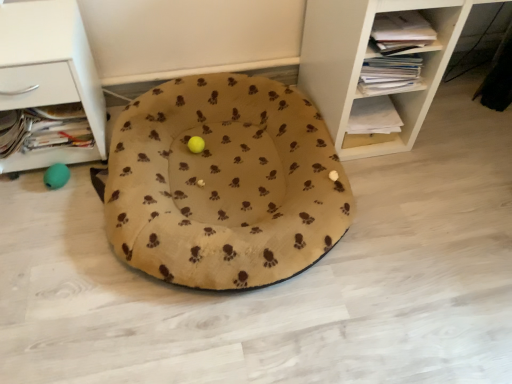
Question: Does white wood shelf at upper right, which ranks as the second shelf in left-to-right order, have a lesser width compared to beige fleece dog bed at center?

Choices:
 (A) no
 (B) yes

Answer: (B)

Question: From the image's perspective, is white wood shelf at upper right, which is counted as the 1th shelf, starting from the right, above beige fleece dog bed at center?

Choices:
 (A) no
 (B) yes

Answer: (B)

Question: Is white wood shelf at upper right, which is counted as the 1th shelf, starting from the right, to the left of beige fleece dog bed at center from the viewer's perspective?

Choices:
 (A) no
 (B) yes

Answer: (A)

Question: Is white wood shelf at upper right, which ranks as the second shelf in left-to-right order, bigger than beige fleece dog bed at center?

Choices:
 (A) no
 (B) yes

Answer: (B)

Question: Considering the relative positions of white wood shelf at upper right, which ranks as the second shelf in left-to-right order, and beige fleece dog bed at center in the image provided, is white wood shelf at upper right, which ranks as the second shelf in left-to-right order, to the right of beige fleece dog bed at center from the viewer's perspective?

Choices:
 (A) no
 (B) yes

Answer: (B)

Question: Is white wood shelf at upper right, which is counted as the 1th shelf, starting from the right, wider or thinner than white matte drawer at left, positioned as the 2th shelf in right-to-left order?

Choices:
 (A) wide
 (B) thin

Answer: (A)

Question: Do you think white wood shelf at upper right, which is counted as the 1th shelf, starting from the right, is within white matte drawer at left, positioned as the 2th shelf in right-to-left order, or outside of it?

Choices:
 (A) outside
 (B) inside

Answer: (A)

Question: Is white wood shelf at upper right, which ranks as the second shelf in left-to-right order, bigger or smaller than white matte drawer at left, positioned as the 2th shelf in right-to-left order?

Choices:
 (A) big
 (B) small

Answer: (A)

Question: In the image, is white wood shelf at upper right, which ranks as the second shelf in left-to-right order, positioned in front of or behind white matte drawer at left, positioned as the 2th shelf in right-to-left order?

Choices:
 (A) front
 (B) behind

Answer: (A)

Question: Does point (14, 6) appear closer or farther from the camera than point (135, 223)?

Choices:
 (A) farther
 (B) closer

Answer: (A)

Question: Considering the positions of white matte drawer at left, which is counted as the 1th shelf, starting from the left, and beige fleece dog bed at center in the image, is white matte drawer at left, which is counted as the 1th shelf, starting from the left, taller or shorter than beige fleece dog bed at center?

Choices:
 (A) tall
 (B) short

Answer: (A)

Question: In the image, is white matte drawer at left, which is counted as the 1th shelf, starting from the left, positioned in front of or behind beige fleece dog bed at center?

Choices:
 (A) front
 (B) behind

Answer: (B)

Question: From the image's perspective, is white matte drawer at left, positioned as the 2th shelf in right-to-left order, positioned above or below beige fleece dog bed at center?

Choices:
 (A) above
 (B) below

Answer: (A)

Question: Is point (20, 94) positioned closer to the camera than point (403, 132)?

Choices:
 (A) farther
 (B) closer

Answer: (B)

Question: From a real-world perspective, is white matte drawer at left, positioned as the 2th shelf in right-to-left order, physically located above or below white wood shelf at upper right, which ranks as the second shelf in left-to-right order?

Choices:
 (A) below
 (B) above

Answer: (A)